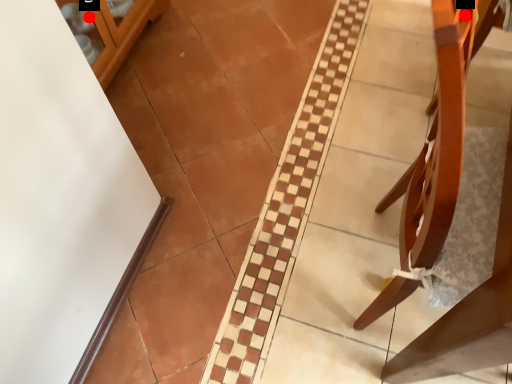
Question: Two points are circled on the image, labeled by A and B beside each circle. Which point is farther to the camera?

Choices:
 (A) A is further
 (B) B is further

Answer: (B)